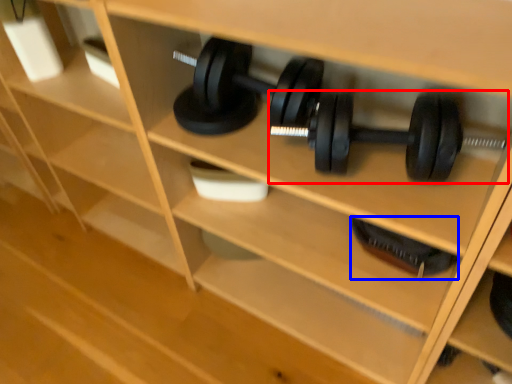
Question: Which of the following is the closest to the observer, dumbbell (highlighted by a red box) or dumbbell (highlighted by a blue box)?

Choices:
 (A) dumbbell
 (B) dumbbell

Answer: (A)